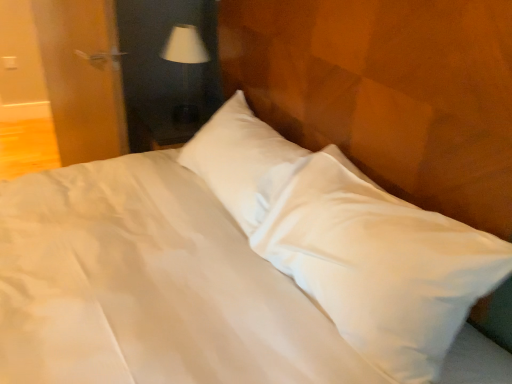
Question: From their relative heights in the image, would you say white fabric lampshade at upper center is taller or shorter than white plastic electric outlet at upper left?

Choices:
 (A) tall
 (B) short

Answer: (A)

Question: Based on their positions, is white fabric lampshade at upper center located to the left or right of white plastic electric outlet at upper left?

Choices:
 (A) left
 (B) right

Answer: (B)

Question: Which object is the closest to the white fabric lampshade at upper center?

Choices:
 (A) white plastic electric outlet at upper left
 (B) wooden door at left

Answer: (B)

Question: Which object is the farthest from the wooden door at left?

Choices:
 (A) white plastic electric outlet at upper left
 (B) white fabric lampshade at upper center

Answer: (A)